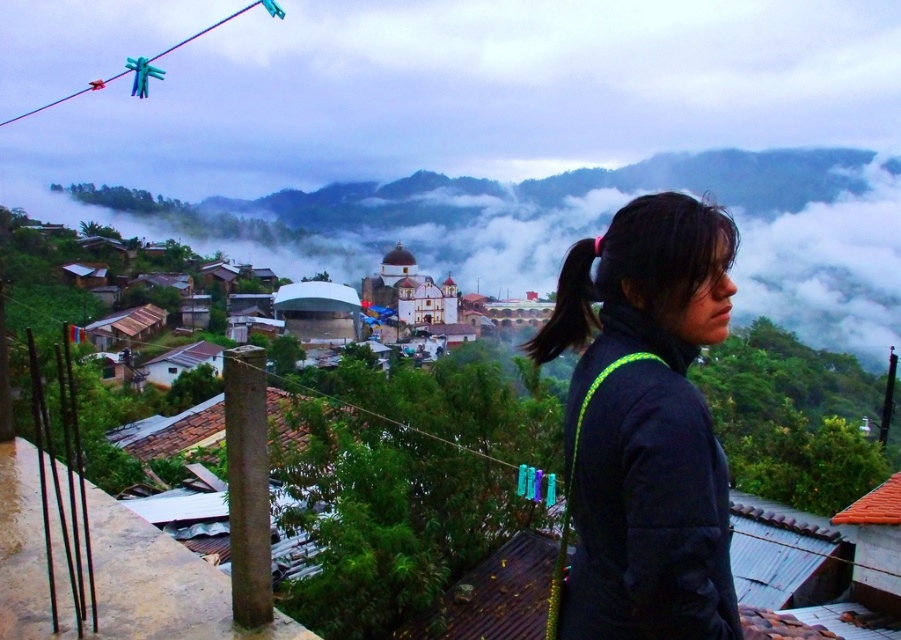
Question: Can you confirm if black fleece jacket at right is positioned below black hair at right?

Choices:
 (A) yes
 (B) no

Answer: (A)

Question: Does black fleece jacket at right have a smaller size compared to black hair at right?

Choices:
 (A) yes
 (B) no

Answer: (A)

Question: Is black fleece jacket at right above black hair at right?

Choices:
 (A) yes
 (B) no

Answer: (B)

Question: Which point is farther from the camera taking this photo?

Choices:
 (A) (560, 280)
 (B) (624, 620)

Answer: (A)